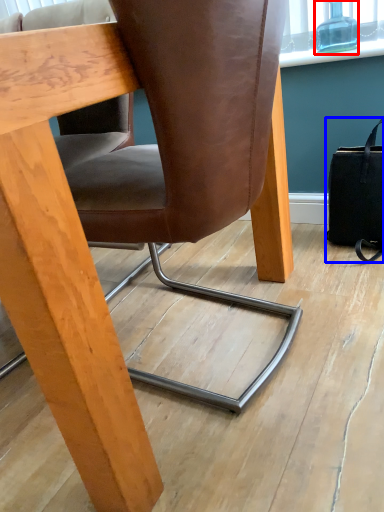
Question: Which object appears farthest to the camera in this image, bottle (highlighted by a red box) or handbag (highlighted by a blue box)?

Choices:
 (A) bottle
 (B) handbag

Answer: (A)